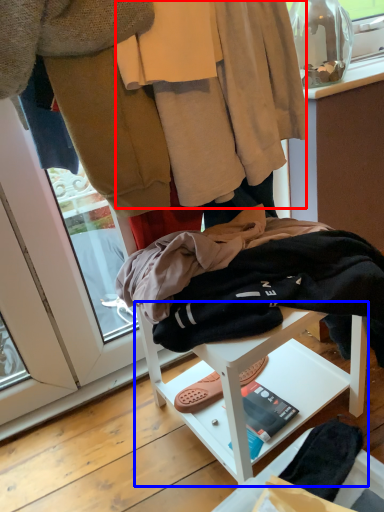
Question: Which object appears closest to the camera in this image, robe (highlighted by a red box) or furniture (highlighted by a blue box)?

Choices:
 (A) robe
 (B) furniture

Answer: (B)